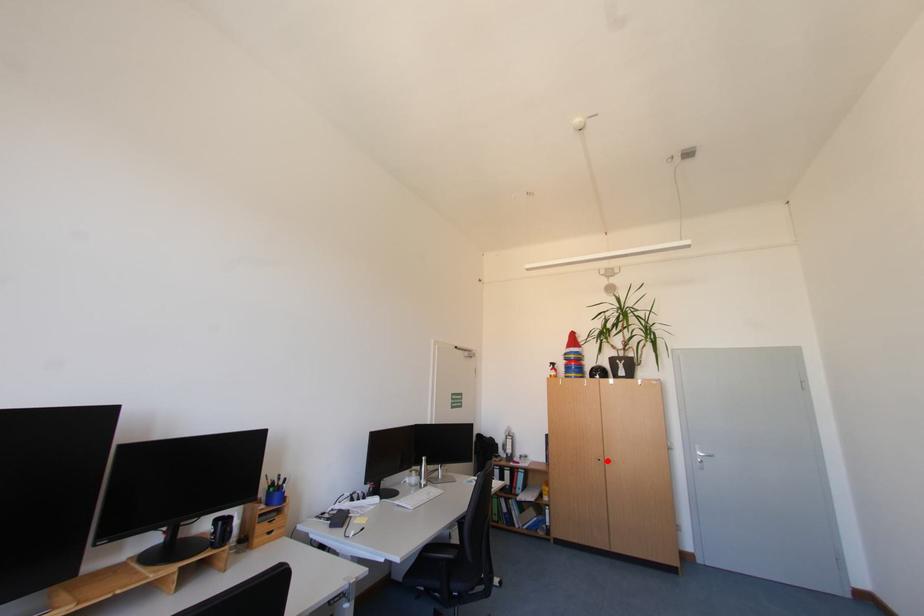
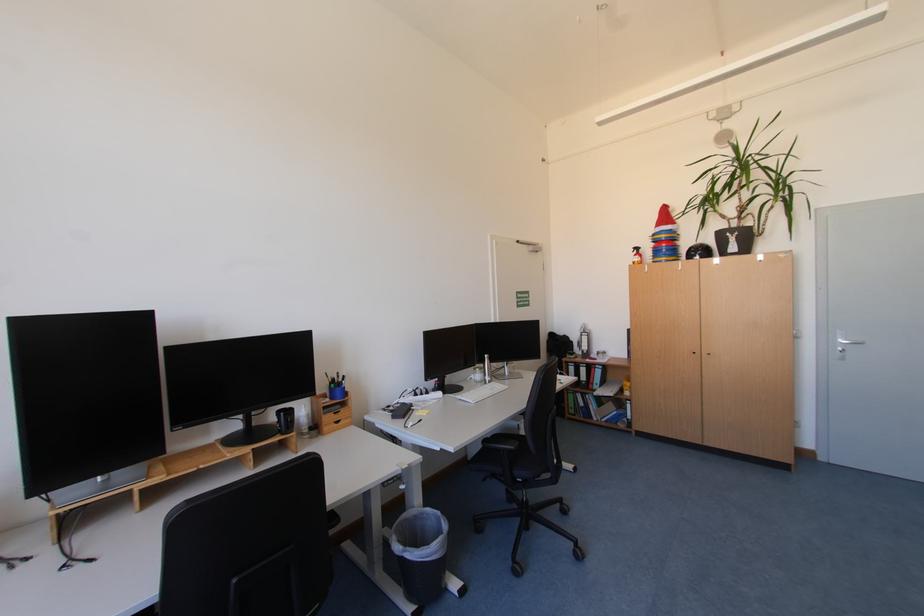
Where in the second image is the point corresponding to the highlighted location from the first image?

(701, 354)